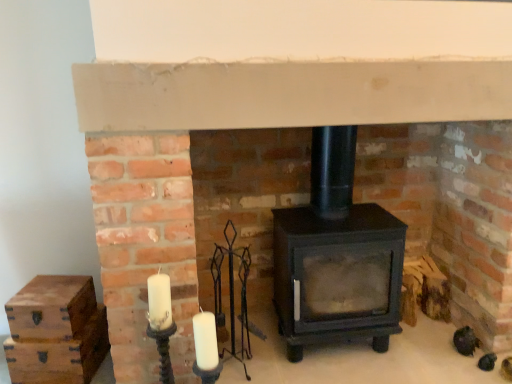
Question: Can you confirm if wooden chest at left, the second drawer when ordered from bottom to top, is taller than wooden chest at lower left, which appears as the first drawer when ordered from the bottom?

Choices:
 (A) yes
 (B) no

Answer: (B)

Question: Does wooden chest at left, arranged as the 1th drawer when viewed from the top, have a smaller size compared to wooden chest at lower left, the 2th drawer from the top?

Choices:
 (A) yes
 (B) no

Answer: (A)

Question: Is wooden chest at left, arranged as the 1th drawer when viewed from the top, shorter than wooden chest at lower left, the 2th drawer from the top?

Choices:
 (A) yes
 (B) no

Answer: (A)

Question: Is wooden chest at left, the second drawer when ordered from bottom to top, next to wooden chest at lower left, the 2th drawer from the top, and touching it?

Choices:
 (A) no
 (B) yes

Answer: (A)

Question: Is wooden chest at left, the second drawer when ordered from bottom to top, facing away from wooden chest at lower left, the 2th drawer from the top?

Choices:
 (A) no
 (B) yes

Answer: (A)

Question: In terms of size, does matte black wood burning stove at center appear bigger or smaller than wooden chest at left, the second drawer when ordered from bottom to top?

Choices:
 (A) small
 (B) big

Answer: (B)

Question: Would you say matte black wood burning stove at center is to the left or to the right of wooden chest at left, arranged as the 1th drawer when viewed from the top, in the picture?

Choices:
 (A) right
 (B) left

Answer: (A)

Question: Considering the positions of matte black wood burning stove at center and wooden chest at left, the second drawer when ordered from bottom to top, in the image, is matte black wood burning stove at center wider or thinner than wooden chest at left, the second drawer when ordered from bottom to top,?

Choices:
 (A) wide
 (B) thin

Answer: (A)

Question: Is matte black wood burning stove at center taller or shorter than wooden chest at left, the second drawer when ordered from bottom to top?

Choices:
 (A) tall
 (B) short

Answer: (A)

Question: Is matte black wood burning stove at center wider or thinner than wooden chest at lower left, the 2th drawer from the top?

Choices:
 (A) thin
 (B) wide

Answer: (B)

Question: From a real-world perspective, is matte black wood burning stove at center physically located above or below wooden chest at lower left, which appears as the first drawer when ordered from the bottom?

Choices:
 (A) below
 (B) above

Answer: (B)

Question: Considering the relative positions of matte black wood burning stove at center and wooden chest at lower left, the 2th drawer from the top, in the image provided, is matte black wood burning stove at center to the left or to the right of wooden chest at lower left, the 2th drawer from the top,?

Choices:
 (A) left
 (B) right

Answer: (B)

Question: Considering their positions, is matte black wood burning stove at center located in front of or behind wooden chest at lower left, which appears as the first drawer when ordered from the bottom?

Choices:
 (A) behind
 (B) front

Answer: (B)

Question: Does point (29, 340) appear closer or farther from the camera than point (52, 306)?

Choices:
 (A) farther
 (B) closer

Answer: (A)

Question: Is wooden chest at lower left, which appears as the first drawer when ordered from the bottom, taller or shorter than wooden chest at left, arranged as the 1th drawer when viewed from the top?

Choices:
 (A) short
 (B) tall

Answer: (B)